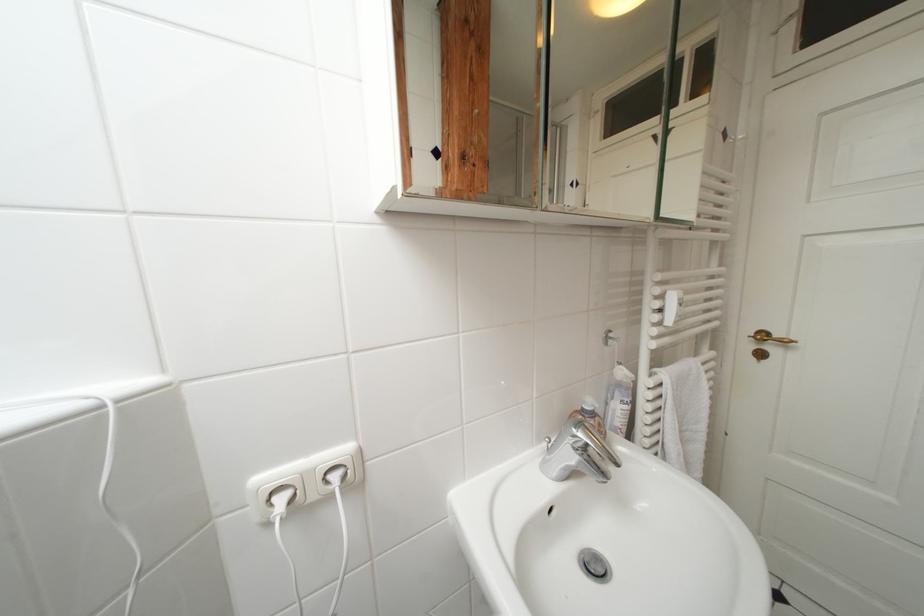
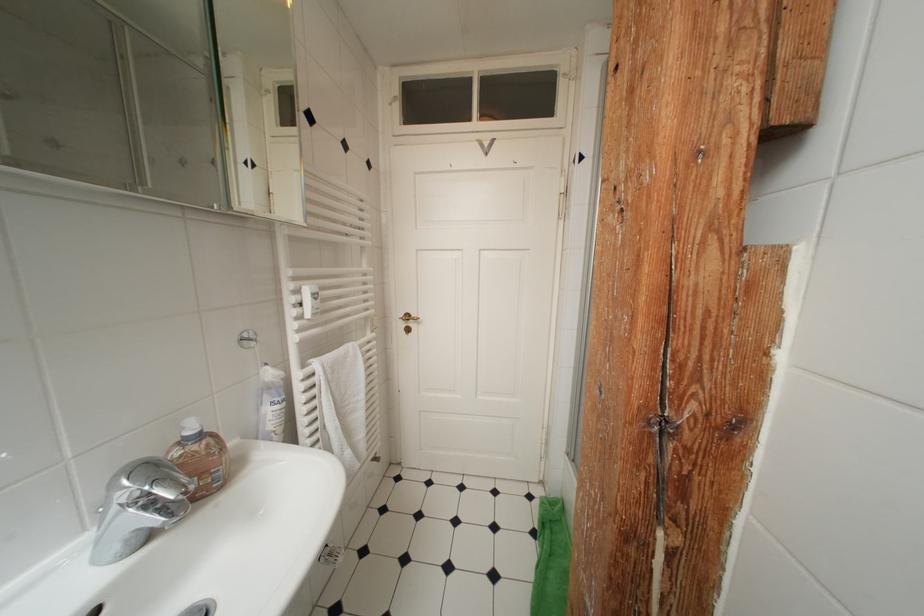
Where in the second image is the point corresponding to point (599, 424) from the first image?

(201, 451)